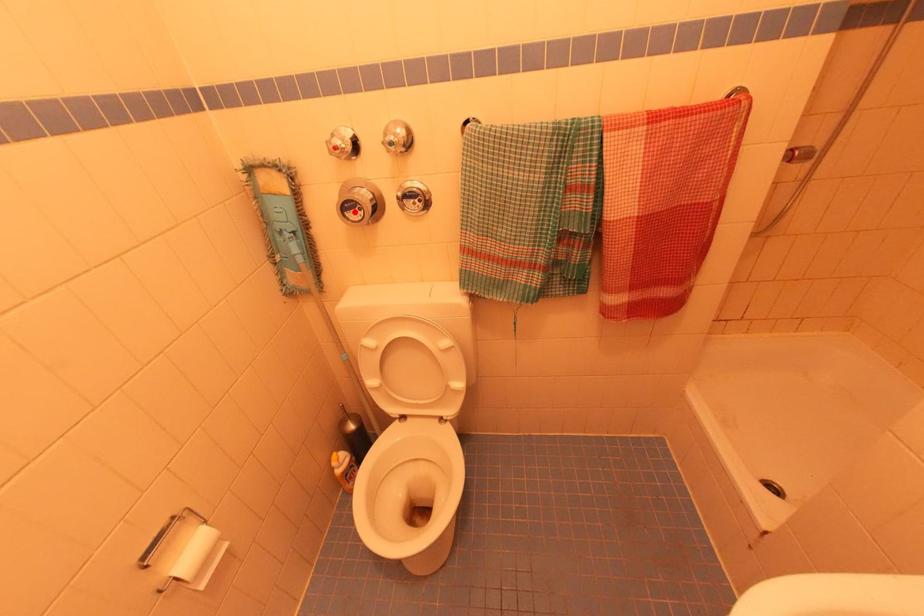
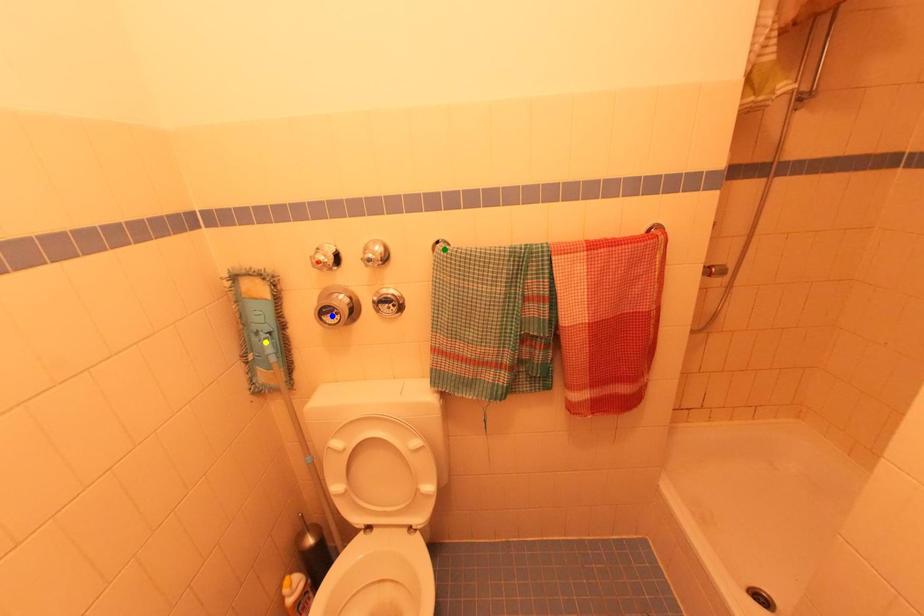
Question: I am providing you with two images of the same scene from different viewpoints. A red point is marked on the first image. You are given multiple points on the second image. Which spot in image 2 lines up with the point in image 1?

Choices:
 (A) yellow point
 (B) blue point
 (C) green point

Answer: (B)